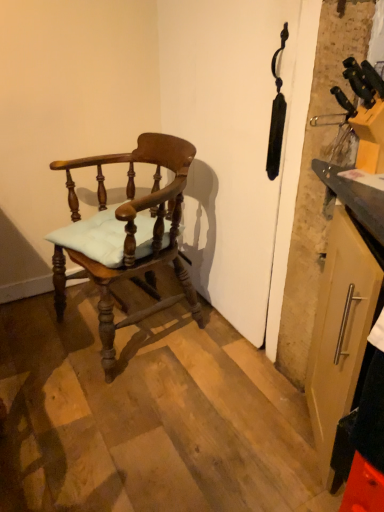
Question: Can you confirm if matte silver handle on the right is smaller than matte wood chair at left?

Choices:
 (A) yes
 (B) no

Answer: (A)

Question: From the image's perspective, is matte silver handle on the right above matte wood chair at left?

Choices:
 (A) yes
 (B) no

Answer: (B)

Question: Is matte silver handle on the right not near matte wood chair at left?

Choices:
 (A) no
 (B) yes

Answer: (A)

Question: Is matte silver handle on the right facing away from matte wood chair at left?

Choices:
 (A) no
 (B) yes

Answer: (A)

Question: From a real-world perspective, is matte silver handle on the right under matte wood chair at left?

Choices:
 (A) no
 (B) yes

Answer: (A)

Question: Can you confirm if matte silver handle on the right is positioned to the right of matte wood chair at left?

Choices:
 (A) yes
 (B) no

Answer: (A)

Question: Is matte wood chair at left smaller than matte silver handle on the right?

Choices:
 (A) no
 (B) yes

Answer: (A)

Question: Does matte wood chair at left turn towards matte silver handle on the right?

Choices:
 (A) no
 (B) yes

Answer: (A)

Question: Is the depth of matte wood chair at left less than that of matte silver handle on the right?

Choices:
 (A) no
 (B) yes

Answer: (A)

Question: Is matte wood chair at left not inside matte silver handle on the right?

Choices:
 (A) yes
 (B) no

Answer: (A)

Question: Is matte wood chair at left further to camera compared to matte silver handle on the right?

Choices:
 (A) yes
 (B) no

Answer: (A)

Question: Can you confirm if matte wood chair at left is bigger than matte silver handle on the right?

Choices:
 (A) yes
 (B) no

Answer: (A)

Question: Is point (137, 148) closer or farther from the camera than point (367, 247)?

Choices:
 (A) closer
 (B) farther

Answer: (B)